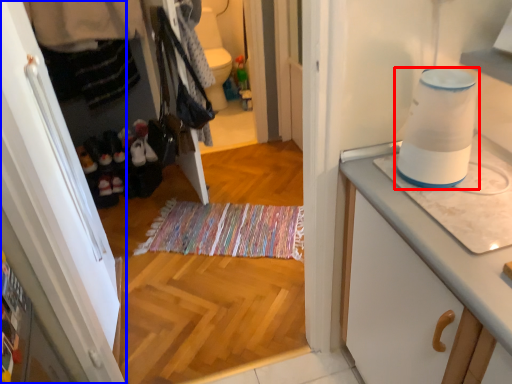
Question: Which object is closer to the camera taking this photo, home appliance (highlighted by a red box) or cabinetry (highlighted by a blue box)?

Choices:
 (A) home appliance
 (B) cabinetry

Answer: (A)